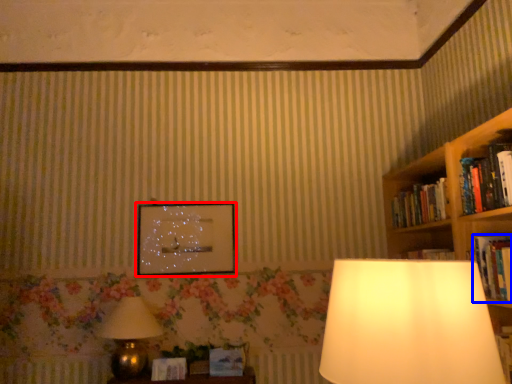
Question: Which of the following is the closest to the observer, picture frame (highlighted by a red box) or book (highlighted by a blue box)?

Choices:
 (A) picture frame
 (B) book

Answer: (B)